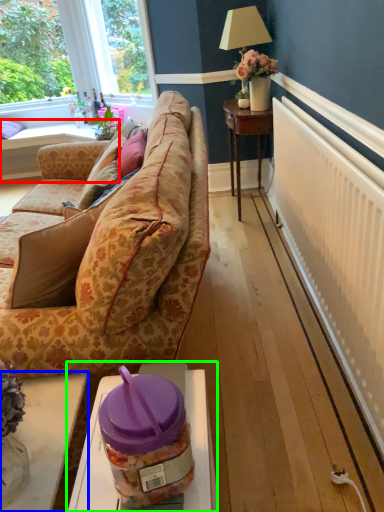
Question: Based on their relative distances, which object is nearer to table (highlighted by a red box)? Choose from table (highlighted by a blue box) and table (highlighted by a green box).

Choices:
 (A) table
 (B) table

Answer: (A)